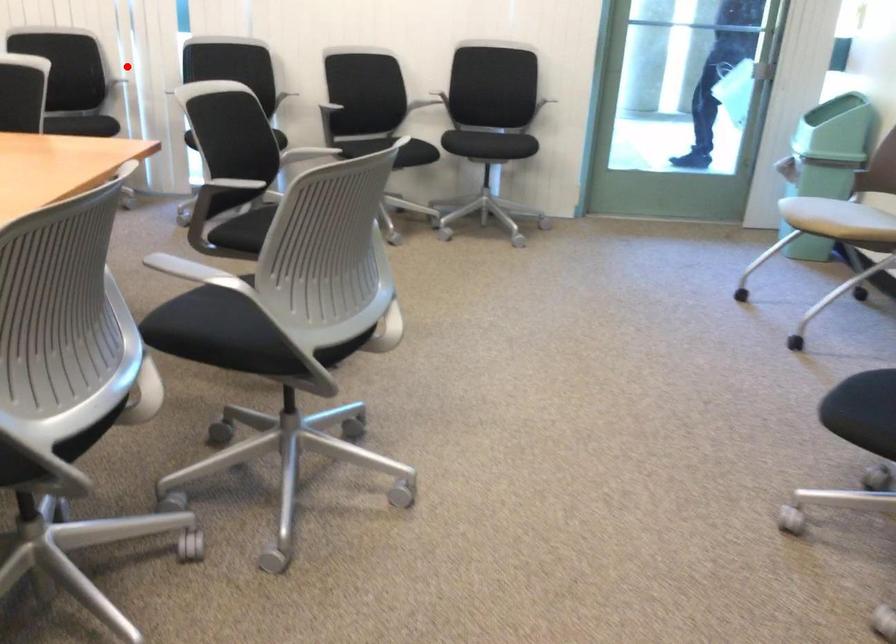
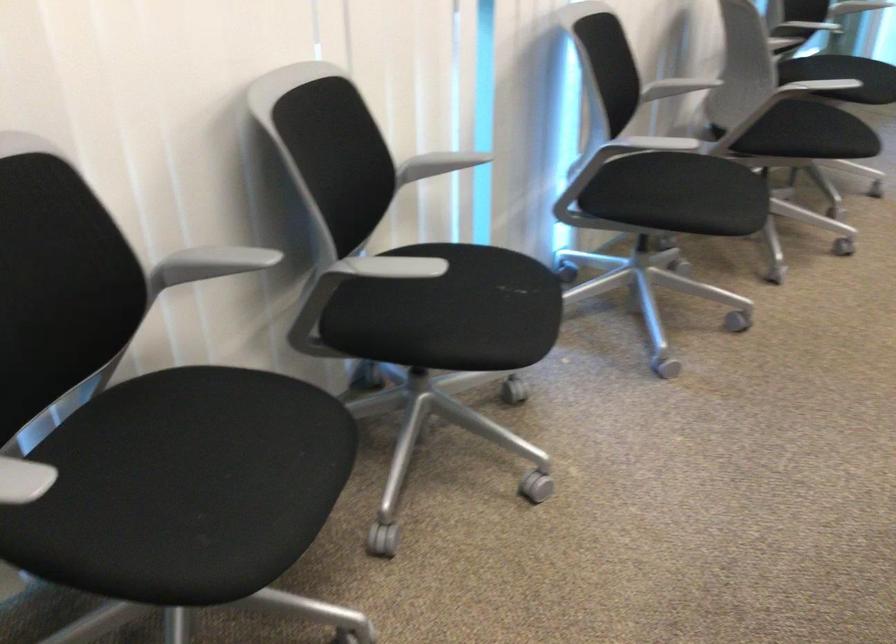
Question: I am providing you with two images of the same scene from different viewpoints. Given a red point in image1, look at the same physical point in image2. Is it:

Choices:
 (A) Closer to the viewpoint
 (B) Farther from the viewpoint

Answer: (A)